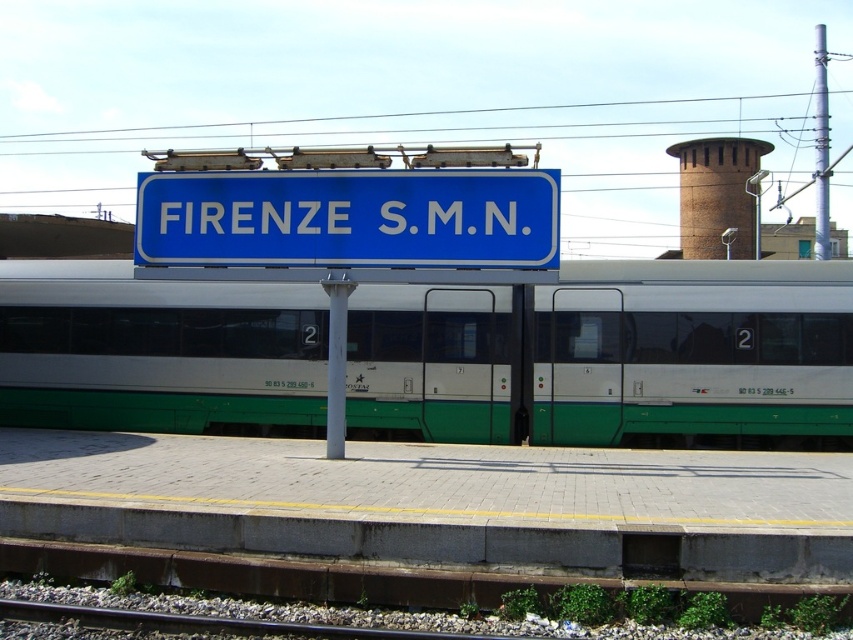
Question: Which object is closer to the camera taking this photo?

Choices:
 (A) blue plastic sign at center
 (B) white metallic pole at center

Answer: (A)

Question: Can you confirm if green metallic train at center is positioned to the left of white metallic pole at center?

Choices:
 (A) yes
 (B) no

Answer: (B)

Question: Where is blue plastic sign at center located in relation to white metallic pole at center in the image?

Choices:
 (A) above
 (B) below

Answer: (A)

Question: Can you confirm if green metallic train at center is bigger than blue plastic sign at center?

Choices:
 (A) yes
 (B) no

Answer: (A)

Question: Which object is the farthest from the green metallic train at center?

Choices:
 (A) white metallic pole at center
 (B) blue plastic sign at center

Answer: (B)

Question: Which point is closer to the camera?

Choices:
 (A) blue plastic sign at center
 (B) green metallic train at center

Answer: (A)